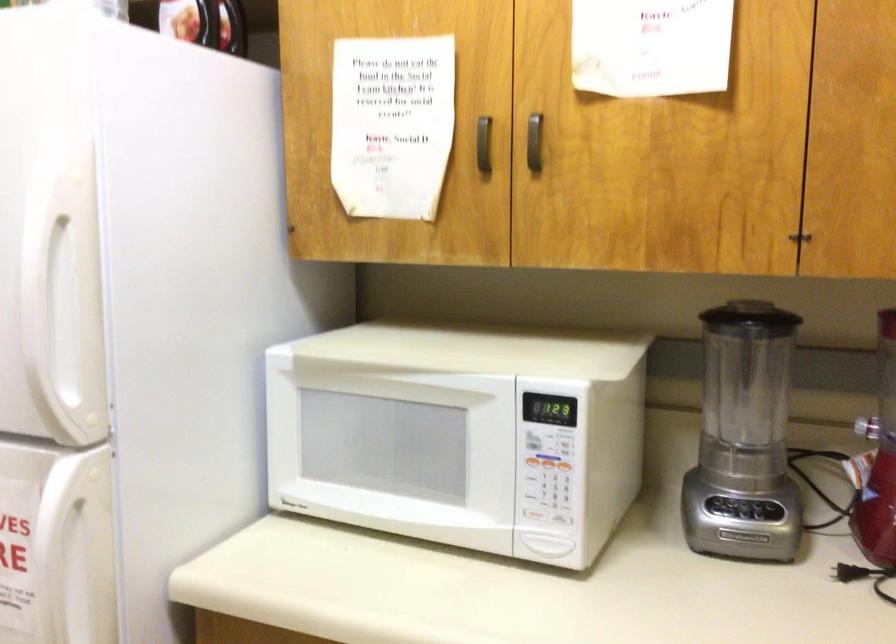
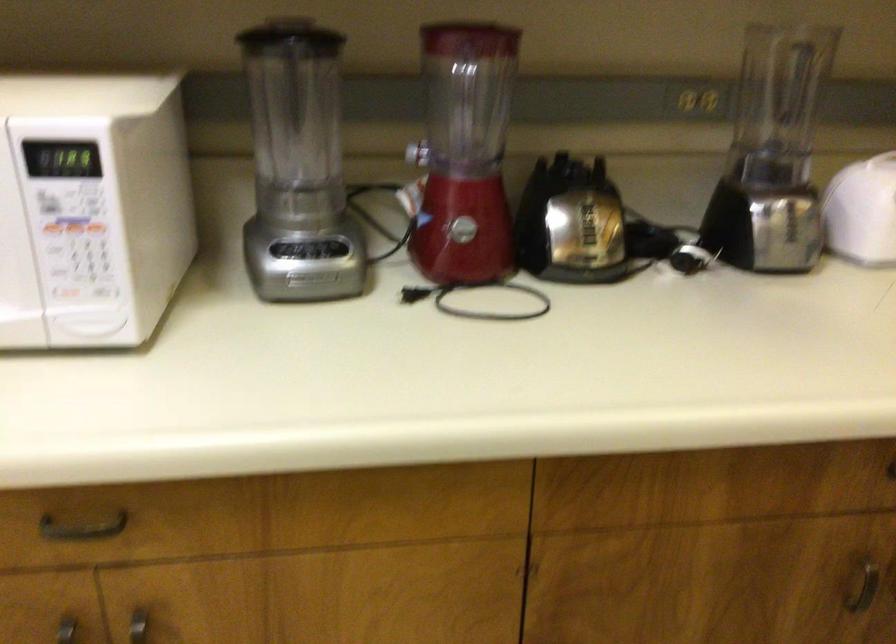
Where in the second image is the point corresponding to the point at 746,507 from the first image?

(308, 249)